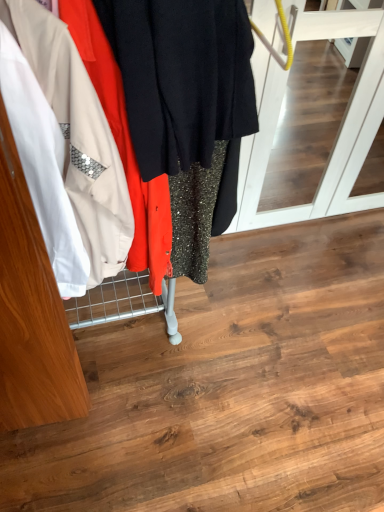
Locate an element on the screen. This screenshot has width=384, height=512. free space in front of metallic sequined dress at left is located at coordinates (123, 448).